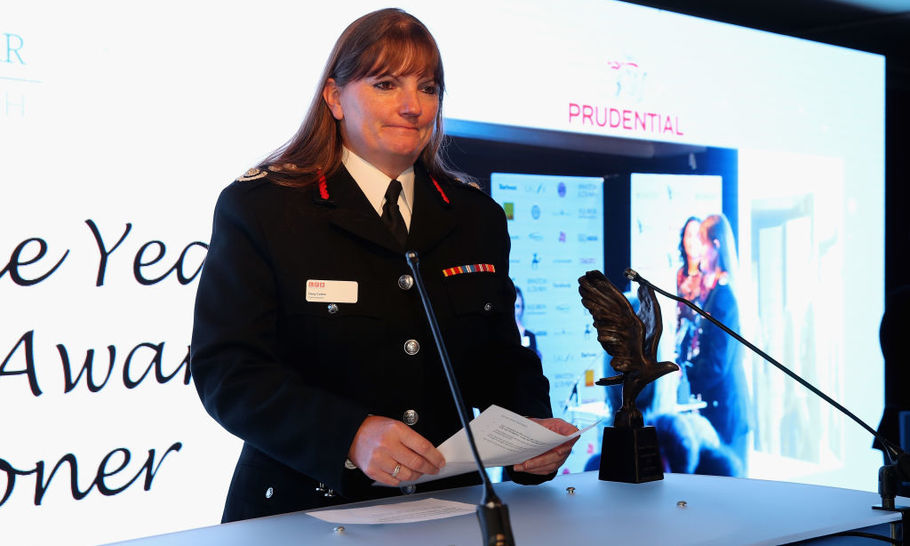
Locate an element on the screen. The height and width of the screenshot is (546, 910). white smooth table surface is located at coordinates (651, 520).